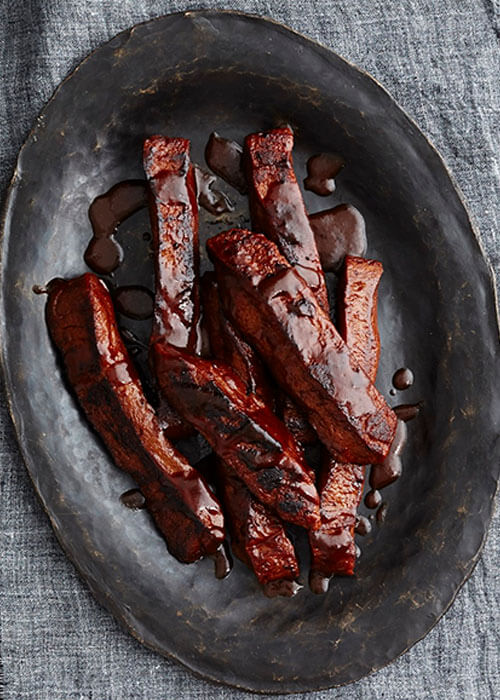
This screenshot has width=500, height=700. Find the location of `tablecloth`. tablecloth is located at coordinates (464, 647).